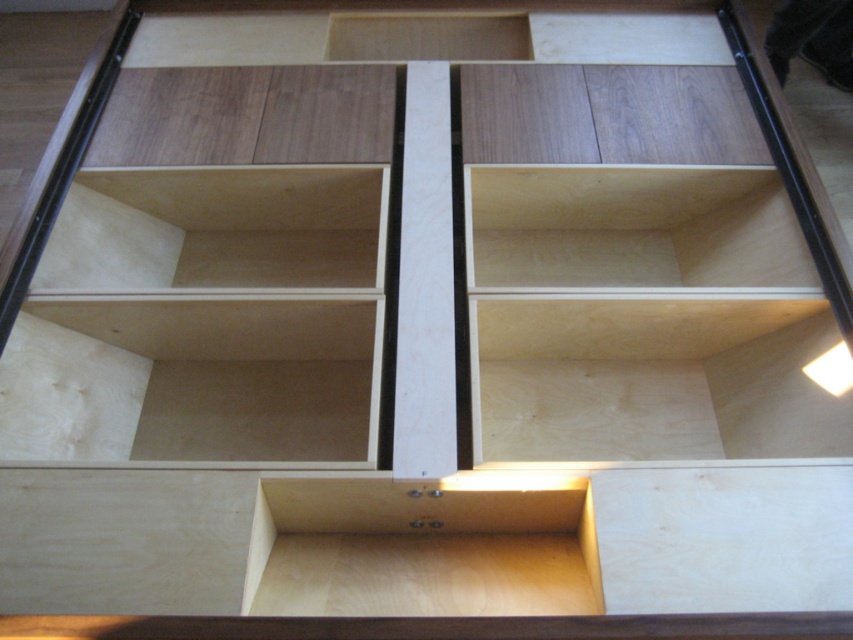
Question: Among these points, which one is farthest from the camera?

Choices:
 (A) click(x=563, y=216)
 (B) click(x=376, y=172)

Answer: (A)

Question: Is light wood/unfinished wood shelf at upper left below natural wood shelf at center-right?

Choices:
 (A) yes
 (B) no

Answer: (A)

Question: Does light wood/unfinished wood shelf at upper left lie behind natural wood shelf at center-right?

Choices:
 (A) yes
 (B) no

Answer: (B)

Question: Can you confirm if light wood/unfinished wood shelf at upper left is positioned below natural wood shelf at center-right?

Choices:
 (A) no
 (B) yes

Answer: (B)

Question: Which point is farther to the camera?

Choices:
 (A) light wood/unfinished wood shelf at upper left
 (B) natural wood shelf at center-right

Answer: (B)